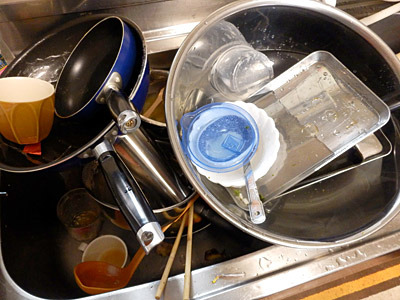
What are the coordinates of `silver bowl` in the screenshot? It's located at (353, 19).